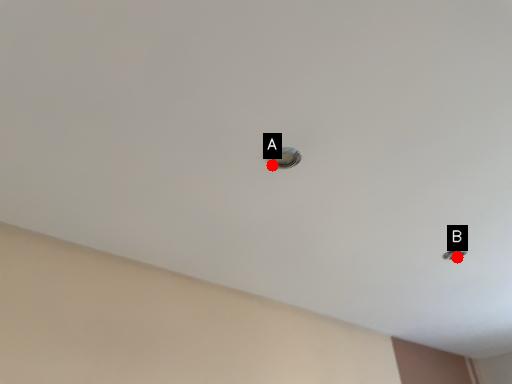
Question: Two points are circled on the image, labeled by A and B beside each circle. Which point is closer to the camera?

Choices:
 (A) A is closer
 (B) B is closer

Answer: (A)